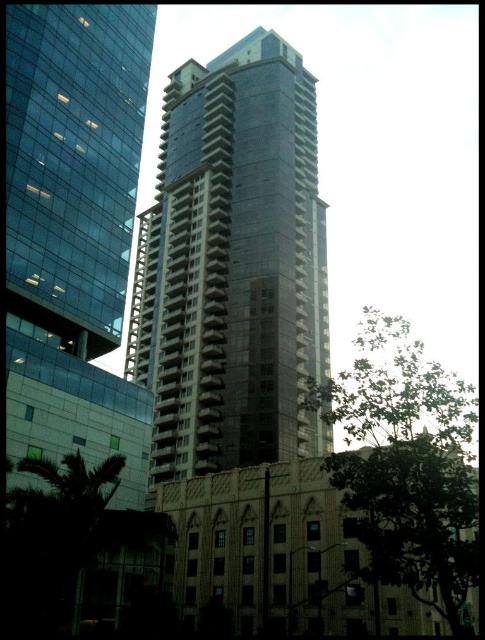
Question: Does smooth glass tower at center appear under green leafy tree at lower left?

Choices:
 (A) no
 (B) yes

Answer: (A)

Question: Which point is closer to the camera?

Choices:
 (A) (31, 512)
 (B) (436, 385)

Answer: (B)

Question: Does smooth glass tower at center appear over green leafy tree at center?

Choices:
 (A) no
 (B) yes

Answer: (B)

Question: Considering the real-world distances, which object is closest to the green leafy tree at lower left?

Choices:
 (A) smooth glass tower at center
 (B) green leafy tree at center

Answer: (B)

Question: Does smooth glass tower at center have a larger size compared to green leafy tree at lower left?

Choices:
 (A) no
 (B) yes

Answer: (B)

Question: Which point is farther to the camera?

Choices:
 (A) green leafy tree at center
 (B) green leafy tree at lower left

Answer: (B)